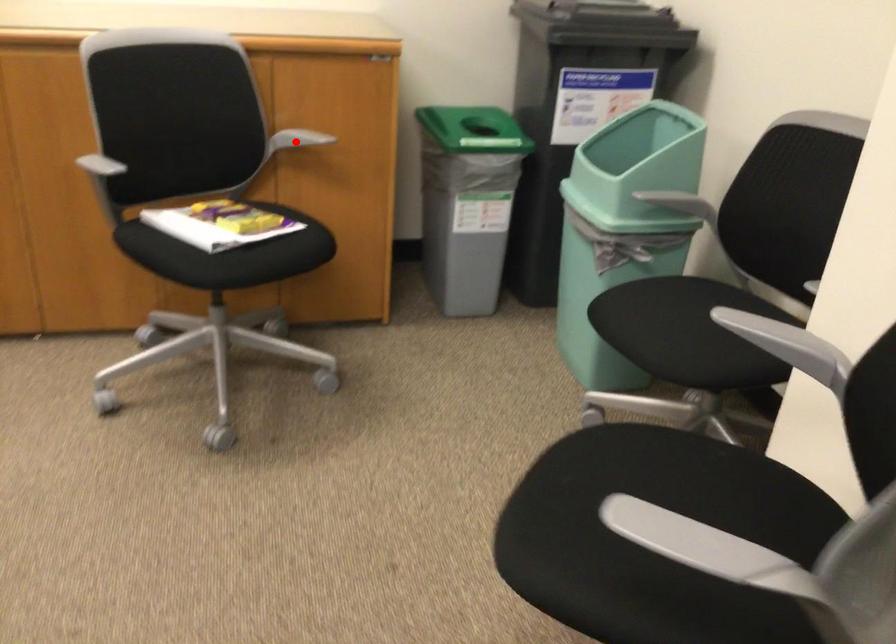
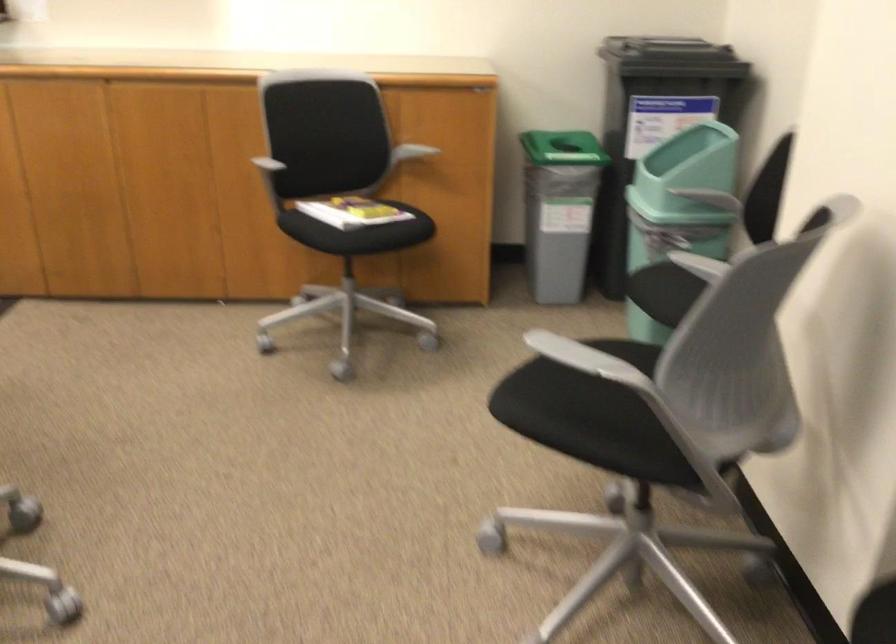
Question: I am providing you with two images of the same scene from different viewpoints. A red point is shown in image1. For the corresponding object point in image2, is it positioned nearer or farther from the camera?

Choices:
 (A) Nearer
 (B) Farther

Answer: (B)